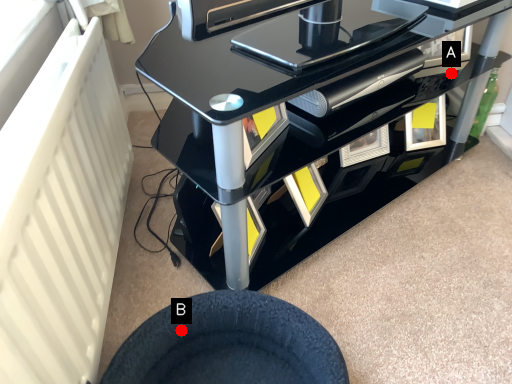
Question: Two points are circled on the image, labeled by A and B beside each circle. Which point appears closest to the camera in this image?

Choices:
 (A) A is closer
 (B) B is closer

Answer: (B)